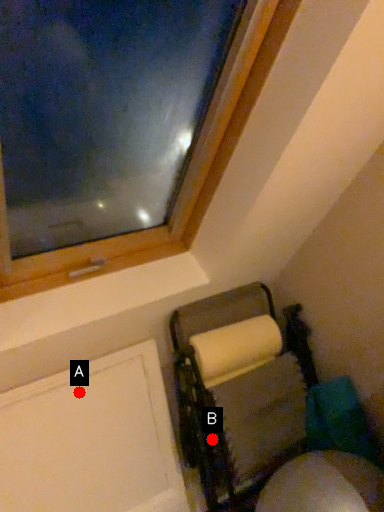
Question: Two points are circled on the image, labeled by A and B beside each circle. Which of the following is the closest to the observer?

Choices:
 (A) A is closer
 (B) B is closer

Answer: (A)